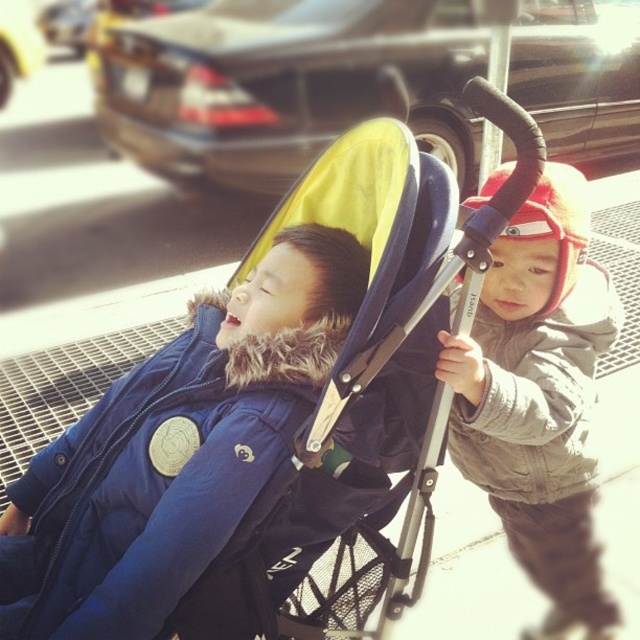
In the scene shown: You are a parent trying to decide whether to let your child stand on a small stool to reach the top shelf. The yellow fabric baby carriage at center and the gray fleece jacket at right are in the room. Which object is shorter and would be easier for the child to see over?

The yellow fabric baby carriage at center is shorter than the gray fleece jacket at right, so it would be easier for the child to see over.

Please provide the 2D coordinates of the blue down jacket at left in the image. The coordinates should be in the format of a point with two decimal places, such as 0.12,0.34.

The 2D coordinates of the blue down jacket at left are at point (164,474).

You are a parent trying to fit both the yellow fabric baby carriage at center and the gray fleece jacket at right into the trunk of your car. Based on the image, which item is wider and would require more space horizontally?

The yellow fabric baby carriage at center might be wider than gray fleece jacket at right, so it would require more horizontal space in the trunk.